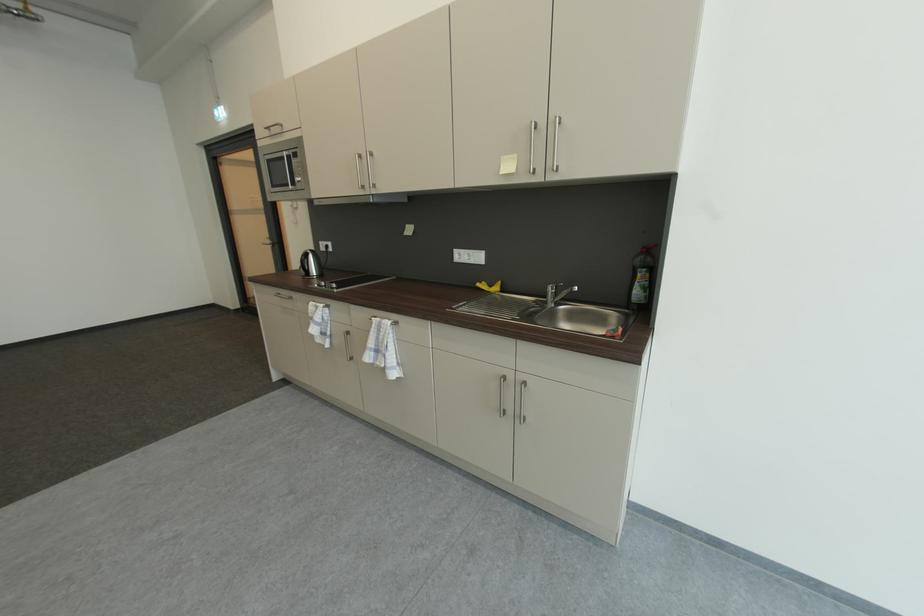
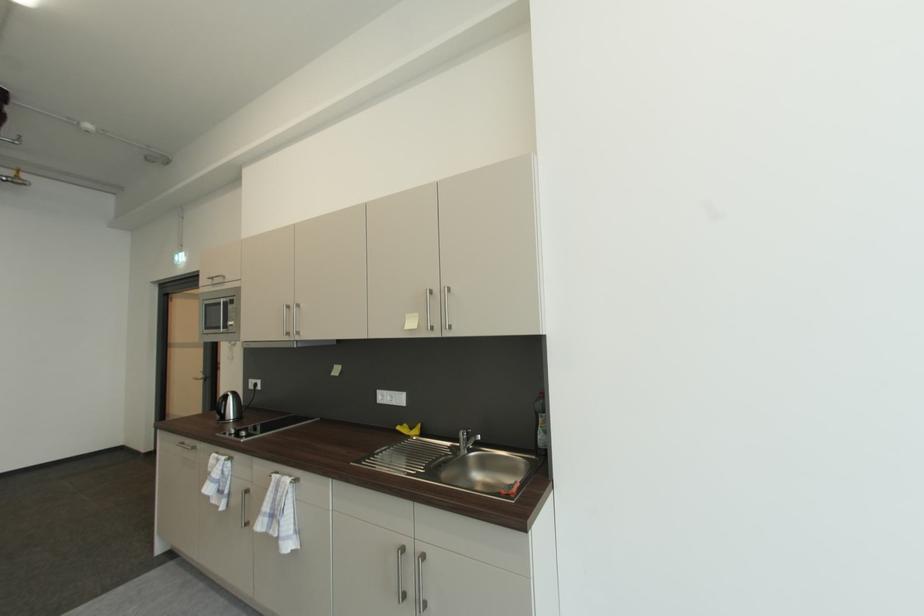
Find the pixel in the second image that matches point (378, 322) in the first image.

(277, 477)